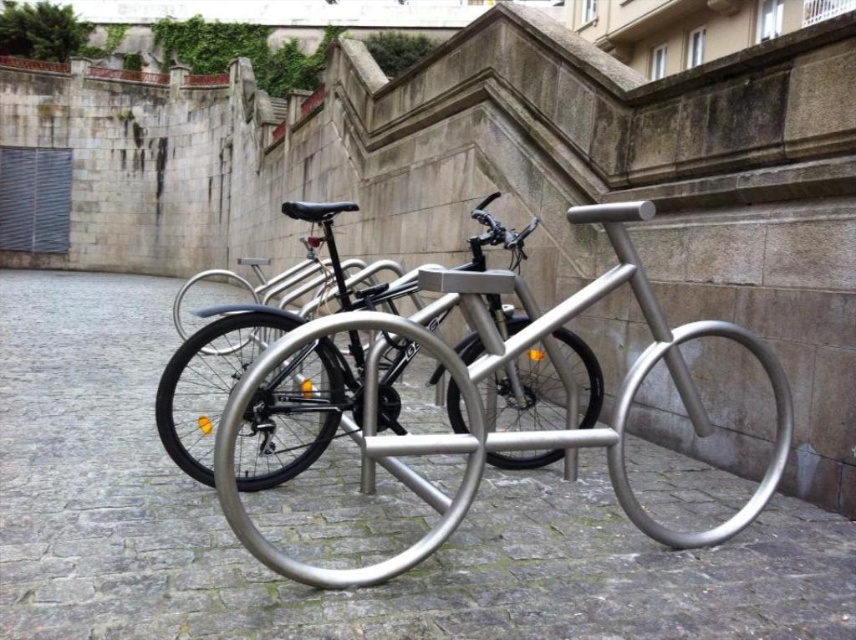
You are standing in front of the bicycle rack and want to determine which of the two points, point (153, 365) or point (191, 464), is closer to you. Based on the scene description, which point is nearer?

Point (153, 365) is further to the viewer than point (191, 464). Wait, no, the description says the opposite. Let me check again. The Objects Description states that point (153, 365) is further to the viewer than point (191, 464). Therefore, the point closer to you would be the one that is not further, so point (191, 464) is closer. So the answer should be point (153, 365) is further, so the closer is point (191, 464).

You need to park your bicycle next to the silver metallic bike rack at center. Can you determine if the polished silver bicycle at center is wider than the rack?

The silver metallic bike rack at center might be wider than polished silver bicycle at center, so it is uncertain whether the polished silver bicycle at center is wider than the rack.